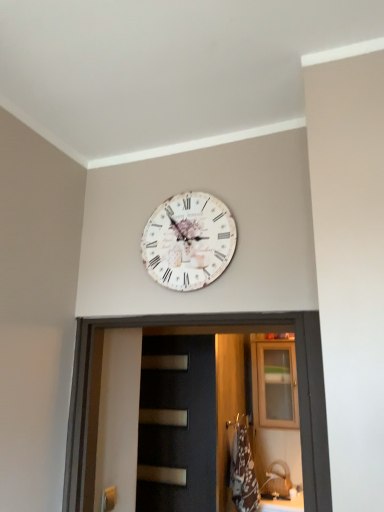
Image resolution: width=384 pixels, height=512 pixels. I want to click on brushed metal door handle at lower left, so tap(109, 499).

What do you see at coordinates (177, 425) in the screenshot? Image resolution: width=384 pixels, height=512 pixels. I see `black matte door at center` at bounding box center [177, 425].

Find the location of a particular element. Image resolution: width=384 pixels, height=512 pixels. white vintage clock at upper center is located at coordinates (189, 241).

Which of these two, white vintage clock at upper center or black matte door at center, is thinner?

With smaller width is white vintage clock at upper center.

Identify the location of wall clock in front of the black matte door at center. (189, 241).

Is point (186, 252) closer to camera compared to point (188, 390)?

Yes, point (186, 252) is closer to viewer.

Could wooden cabinet at upper center be considered to be inside brushed metal door handle at lower left?

No, wooden cabinet at upper center is located outside of brushed metal door handle at lower left.

Which of these two, brushed metal door handle at lower left or wooden cabinet at upper center, stands taller?

wooden cabinet at upper center is taller.

Considering the positions of point (104, 504) and point (283, 400), is point (104, 504) closer or farther from the camera than point (283, 400)?

Point (104, 504) is closer to the camera than point (283, 400).

Does point (202, 372) appear closer or farther from the camera than point (106, 499)?

Point (202, 372) is positioned farther from the camera compared to point (106, 499).

Based on their sizes in the image, would you say black matte door at center is bigger or smaller than brushed metal door handle at lower left?

Considering their sizes, black matte door at center takes up more space than brushed metal door handle at lower left.

From the image's perspective, is black matte door at center located above or below brushed metal door handle at lower left?

Clearly, from the image's perspective, black matte door at center is below brushed metal door handle at lower left.

Is there a large distance between black matte door at center and brushed metal door handle at lower left?

black matte door at center is near brushed metal door handle at lower left, not far away.

Does white vintage clock at upper center lie in front of brushed metal door handle at lower left?

That is True.

In terms of size, does white vintage clock at upper center appear bigger or smaller than brushed metal door handle at lower left?

In the image, white vintage clock at upper center appears to be larger than brushed metal door handle at lower left.

How different are the orientations of white vintage clock at upper center and brushed metal door handle at lower left in degrees?

92.5 degrees separate the facing orientations of white vintage clock at upper center and brushed metal door handle at lower left.

Is point (169, 234) in front of point (105, 493)?

Yes, it is in front of point (105, 493).

Can you confirm if brushed metal door handle at lower left is wider than black matte door at center?

Incorrect, the width of brushed metal door handle at lower left does not surpass that of black matte door at center.

Between point (106, 501) and point (159, 411), which one is positioned behind?

The point (159, 411) is farther from the camera.

Do you think brushed metal door handle at lower left is within black matte door at center, or outside of it?

brushed metal door handle at lower left is located beyond the bounds of black matte door at center.

Considering the relative positions of brushed metal door handle at lower left and white vintage clock at upper center in the image provided, is brushed metal door handle at lower left behind white vintage clock at upper center?

Yes, brushed metal door handle at lower left is behind white vintage clock at upper center.

Is white vintage clock at upper center inside brushed metal door handle at lower left?

No, brushed metal door handle at lower left does not contain white vintage clock at upper center.

From a real-world perspective, is brushed metal door handle at lower left under white vintage clock at upper center?

Yes.

Considering the relative sizes of brushed metal door handle at lower left and white vintage clock at upper center in the image provided, is brushed metal door handle at lower left shorter than white vintage clock at upper center?

Indeed, brushed metal door handle at lower left has a lesser height compared to white vintage clock at upper center.

Between wooden cabinet at upper center and brushed metal door handle at lower left, which one appears on the right side from the viewer's perspective?

From the viewer's perspective, wooden cabinet at upper center appears more on the right side.

What's the angular difference between wooden cabinet at upper center and brushed metal door handle at lower left's facing directions?

89.3 degrees separate the facing orientations of wooden cabinet at upper center and brushed metal door handle at lower left.

Is wooden cabinet at upper center outside of brushed metal door handle at lower left?

Indeed, wooden cabinet at upper center is completely outside brushed metal door handle at lower left.

Who is shorter, wooden cabinet at upper center or brushed metal door handle at lower left?

Standing shorter between the two is brushed metal door handle at lower left.

Image resolution: width=384 pixels, height=512 pixels. I want to click on wall clock that is in front of the black matte door at center, so click(x=189, y=241).

Image resolution: width=384 pixels, height=512 pixels. Identify the location of cabinetry behind the brushed metal door handle at lower left. (274, 383).

From the image, which object appears to be nearer to black matte door at center, white vintage clock at upper center or brushed metal door handle at lower left?

brushed metal door handle at lower left.

Which object lies further to the anchor point wooden cabinet at upper center, brushed metal door handle at lower left or black matte door at center?

brushed metal door handle at lower left is positioned further to the anchor wooden cabinet at upper center.

Based on their spatial positions, is wooden cabinet at upper center or white vintage clock at upper center further from brushed metal door handle at lower left?

wooden cabinet at upper center is positioned further to the anchor brushed metal door handle at lower left.

From the image, which object appears to be nearer to white vintage clock at upper center, wooden cabinet at upper center or black matte door at center?

Among the two, black matte door at center is located nearer to white vintage clock at upper center.

Based on their spatial positions, is black matte door at center or brushed metal door handle at lower left further from white vintage clock at upper center?

Among the two, black matte door at center is located further to white vintage clock at upper center.

Which object lies further to the anchor point white vintage clock at upper center, black matte door at center or wooden cabinet at upper center?

wooden cabinet at upper center.

Based on their spatial positions, is wooden cabinet at upper center or white vintage clock at upper center further from black matte door at center?

Among the two, white vintage clock at upper center is located further to black matte door at center.

Estimate the real-world distances between objects in this image. Which object is further from white vintage clock at upper center, brushed metal door handle at lower left or black matte door at center?

Among the two, black matte door at center is located further to white vintage clock at upper center.

Where is `door handle located between white vintage clock at upper center and wooden cabinet at upper center in the depth direction`? door handle located between white vintage clock at upper center and wooden cabinet at upper center in the depth direction is located at coordinates (109, 499).

Where is `door between white vintage clock at upper center and wooden cabinet at upper center from front to back`? door between white vintage clock at upper center and wooden cabinet at upper center from front to back is located at coordinates (177, 425).

This screenshot has height=512, width=384. In order to click on door handle between white vintage clock at upper center and black matte door at center in the vertical direction in this screenshot , I will do `click(109, 499)`.

You are a GUI agent. You are given a task and a screenshot of the screen. Output one action in this format:
    pyautogui.click(x=<x>, y=<y>)
    Task: Click on the door between brushed metal door handle at lower left and wooden cabinet at upper center along the z-axis
    The width and height of the screenshot is (384, 512).
    Given the screenshot: What is the action you would take?
    pyautogui.click(x=177, y=425)